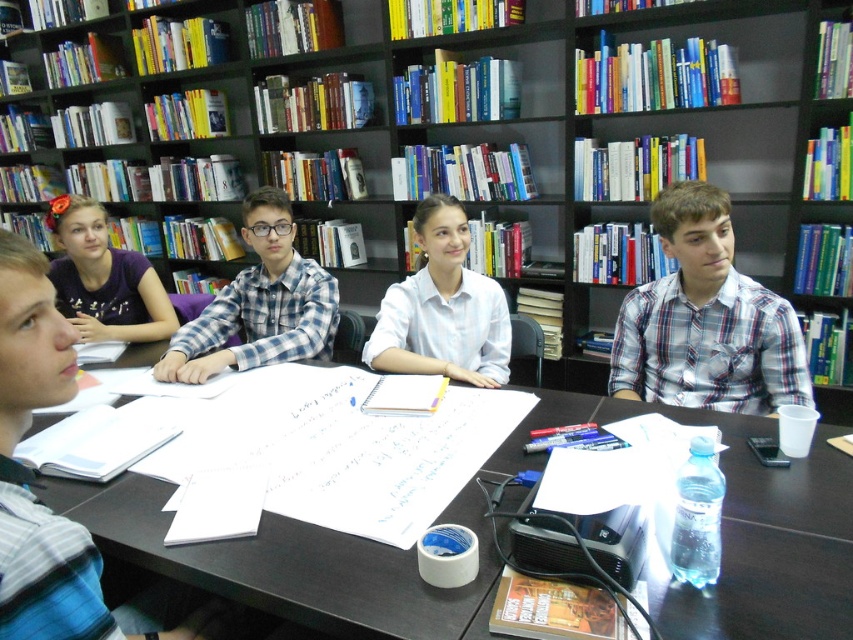
You are a student trying to reach the white shirt at center from the plaid cotton shirt at center. Can you comfortably extend your hand to pass a pen without needing to move your chair? The average human arm span is about 20 inches.

The plaid cotton shirt at center and white shirt at center are 21.26 inches apart. Since the average human arm span is about 20 inches, reaching across this distance would require stretching slightly, but it is possible to extend your hand to pass the pen without moving the chair.

You are part of a group sitting around a table in a study room. You notice two people wearing a plaid cotton shirt at center and a white shirt at center. Which of these two shirts is worn by someone sitting closer to the front of the table?

The plaid cotton shirt at center is much taller as white shirt at center, so the person wearing the plaid cotton shirt at center is sitting closer to the front of the table.